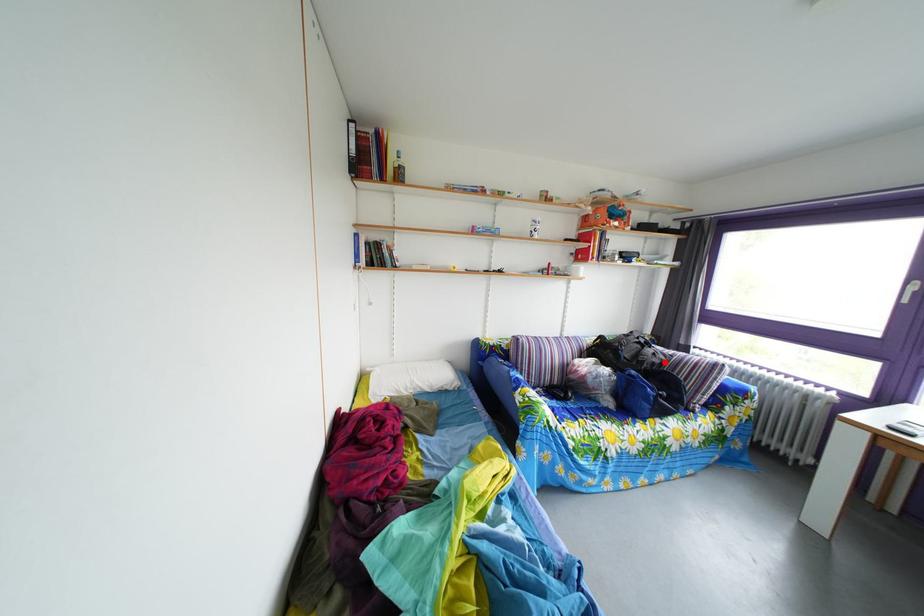
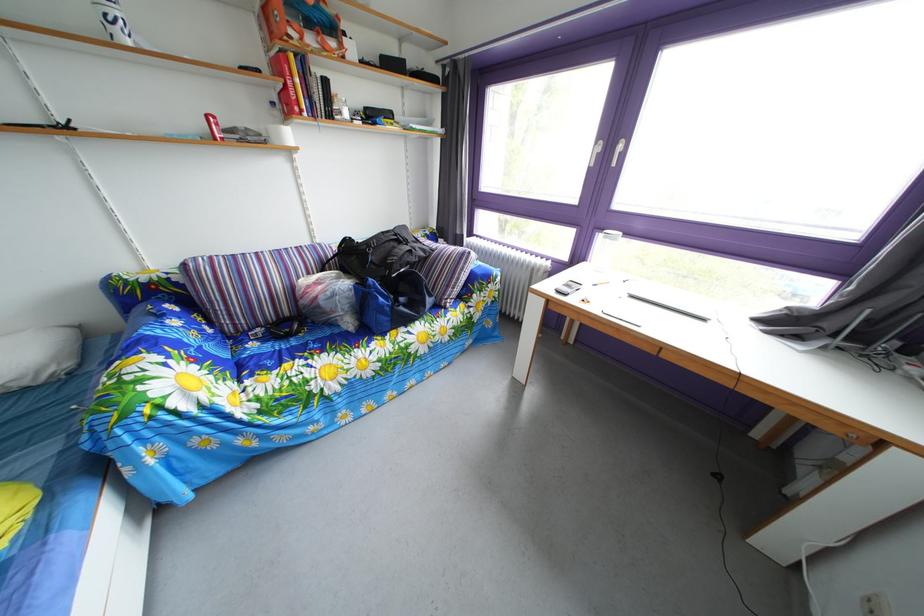
Find the pixel in the second image that matches the highlighted location in the first image.

(421, 260)